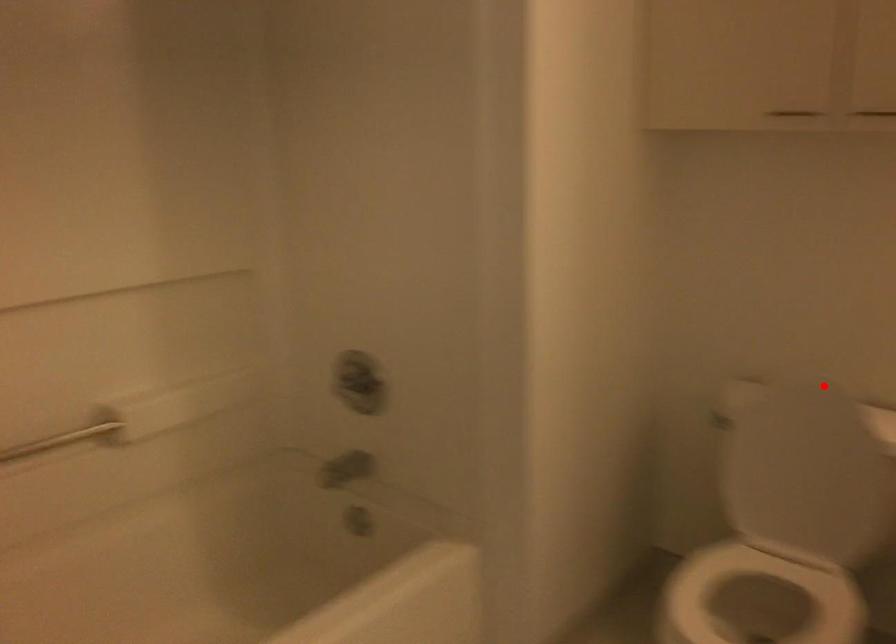
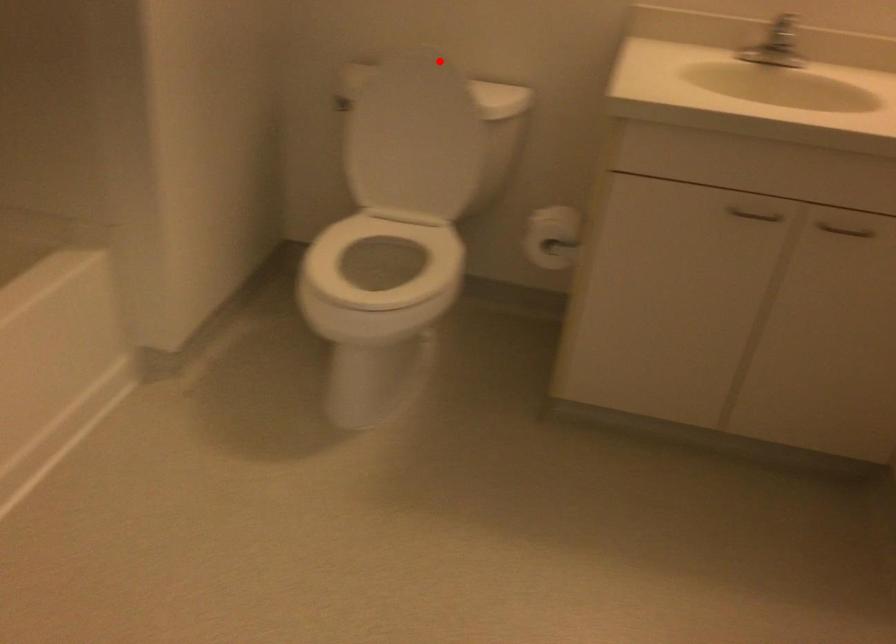
I am providing you with two images of the same scene from different viewpoints. A red point is marked on the first image and another point is marked on the second image. Does the point marked in image1 correspond to the same location as the one in image2?

Yes